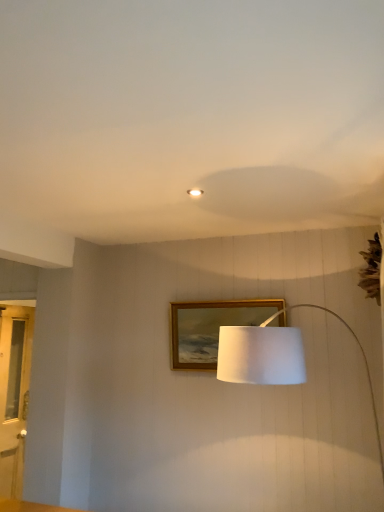
Question: Is matte white ceiling light at center with clear glass door at left?

Choices:
 (A) no
 (B) yes

Answer: (A)

Question: Does matte white ceiling light at center have a larger size compared to clear glass door at left?

Choices:
 (A) yes
 (B) no

Answer: (B)

Question: Can you confirm if matte white ceiling light at center is positioned to the left of clear glass door at left?

Choices:
 (A) yes
 (B) no

Answer: (B)

Question: Can you confirm if matte white ceiling light at center is wider than clear glass door at left?

Choices:
 (A) no
 (B) yes

Answer: (A)

Question: Is matte white ceiling light at center to the right of clear glass door at left from the viewer's perspective?

Choices:
 (A) no
 (B) yes

Answer: (B)

Question: Looking at their shapes, would you say clear glass door at left is wider or thinner than white fabric lampshade at center?

Choices:
 (A) wide
 (B) thin

Answer: (B)

Question: Would you say clear glass door at left is to the left or to the right of white fabric lampshade at center in the picture?

Choices:
 (A) left
 (B) right

Answer: (A)

Question: From a real-world perspective, relative to white fabric lampshade at center, is clear glass door at left vertically above or below?

Choices:
 (A) below
 (B) above

Answer: (A)

Question: Is clear glass door at left in front of or behind white fabric lampshade at center in the image?

Choices:
 (A) behind
 (B) front

Answer: (A)

Question: Is white fabric lampshade at center inside or outside of clear glass door at left?

Choices:
 (A) inside
 (B) outside

Answer: (B)

Question: Looking at their shapes, would you say white fabric lampshade at center is wider or thinner than clear glass door at left?

Choices:
 (A) thin
 (B) wide

Answer: (B)

Question: Would you say white fabric lampshade at center is to the left or to the right of clear glass door at left in the picture?

Choices:
 (A) right
 (B) left

Answer: (A)

Question: From the image's perspective, relative to clear glass door at left, is white fabric lampshade at center above or below?

Choices:
 (A) below
 (B) above

Answer: (B)

Question: Is point (188, 190) positioned closer to the camera than point (350, 329)?

Choices:
 (A) farther
 (B) closer

Answer: (B)

Question: From the image's perspective, is matte white ceiling light at center above or below white fabric lampshade at center?

Choices:
 (A) above
 (B) below

Answer: (A)